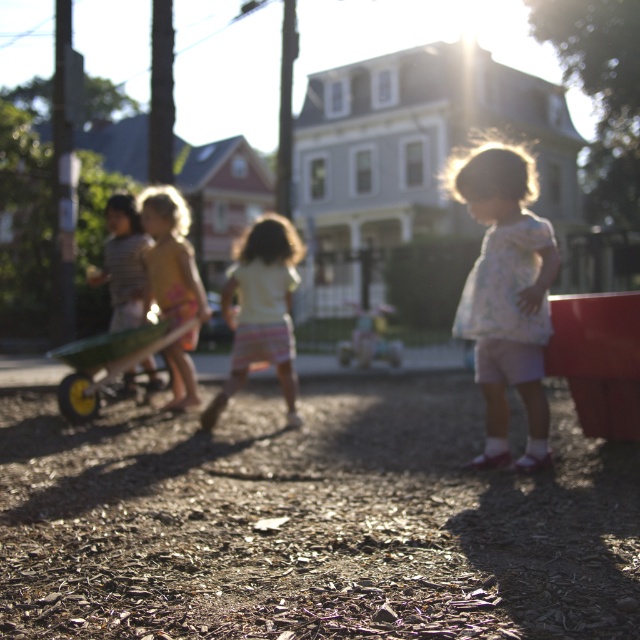
Question: Which point is closer to the camera?

Choices:
 (A) yellow cotton shirt at center
 (B) green plastic wagon at center
 (C) white floral dress at right

Answer: (C)

Question: Based on their relative distances, which object is farther from the matte yellow dress at left?

Choices:
 (A) green plastic wagon at center
 (B) yellow cotton shirt at center
 (C) white floral dress at right

Answer: (C)

Question: Does pastel striped shorts at center appear over green plastic wagon at center?

Choices:
 (A) no
 (B) yes

Answer: (B)

Question: Can you confirm if white floral dress at right is wider than green plastic wagon at center?

Choices:
 (A) yes
 (B) no

Answer: (A)

Question: Among these objects, which one is farthest from the camera?

Choices:
 (A) matte yellow dress at left
 (B) yellow cotton shirt at center
 (C) pastel striped shorts at center
 (D) white floral dress at right

Answer: (A)

Question: Considering the relative positions of yellow cotton shirt at center and green plastic wagon at center in the image provided, where is yellow cotton shirt at center located with respect to green plastic wagon at center?

Choices:
 (A) right
 (B) left

Answer: (A)